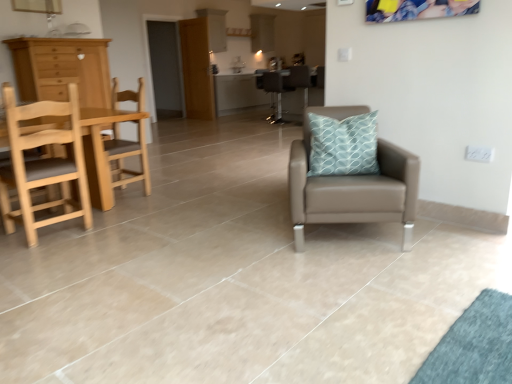
Question: Does brown leather armchair at center have a lesser height compared to leather armchair at center, arranged as the first chair when viewed from the right?

Choices:
 (A) no
 (B) yes

Answer: (B)

Question: Can you confirm if brown leather armchair at center is taller than leather armchair at center, arranged as the first chair when viewed from the right?

Choices:
 (A) yes
 (B) no

Answer: (B)

Question: Does brown leather armchair at center lie in front of leather armchair at center, which is counted as the second chair, starting from the back?

Choices:
 (A) yes
 (B) no

Answer: (B)

Question: Does brown leather armchair at center have a greater width compared to leather armchair at center, the 5th chair positioned from the left?

Choices:
 (A) no
 (B) yes

Answer: (B)

Question: Considering the relative sizes of brown leather armchair at center and leather armchair at center, which is counted as the second chair, starting from the back, in the image provided, is brown leather armchair at center bigger than leather armchair at center, which is counted as the second chair, starting from the back,?

Choices:
 (A) no
 (B) yes

Answer: (A)

Question: Does brown leather armchair at center appear on the right side of leather armchair at center, the 5th chair positioned from the left?

Choices:
 (A) yes
 (B) no

Answer: (B)

Question: Is metallic silver stool at center, the third chair from the right, at the left side of brown leather armchair at center?

Choices:
 (A) no
 (B) yes

Answer: (A)

Question: Considering the relative sizes of metallic silver stool at center, the first chair in the back-to-front sequence, and brown leather armchair at center in the image provided, is metallic silver stool at center, the first chair in the back-to-front sequence, wider than brown leather armchair at center?

Choices:
 (A) no
 (B) yes

Answer: (A)

Question: Can you confirm if metallic silver stool at center, which is the third chair in left-to-right order, is positioned to the right of brown leather armchair at center?

Choices:
 (A) no
 (B) yes

Answer: (B)

Question: Is brown leather armchair at center completely or partially inside metallic silver stool at center, the first chair in the back-to-front sequence?

Choices:
 (A) yes
 (B) no

Answer: (B)

Question: From a real-world perspective, is metallic silver stool at center, which is the third chair in left-to-right order, under brown leather armchair at center?

Choices:
 (A) no
 (B) yes

Answer: (B)

Question: From the image's perspective, is metallic silver stool at center, the third chair from the right, under brown leather armchair at center?

Choices:
 (A) no
 (B) yes

Answer: (B)

Question: Can you confirm if leather armchair at center, marked as the fifth chair in a back-to-front arrangement, is taller than metallic silver stool at center, the first chair in the back-to-front sequence?

Choices:
 (A) yes
 (B) no

Answer: (B)